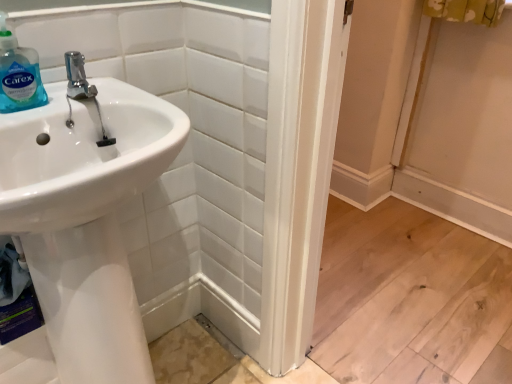
Question: In terms of width, does polished chrome faucet at upper left look wider or thinner when compared to white glossy sink at left?

Choices:
 (A) thin
 (B) wide

Answer: (B)

Question: Would you say polished chrome faucet at upper left is inside or outside white glossy sink at left?

Choices:
 (A) inside
 (B) outside

Answer: (B)

Question: Which object is the closest to the translucent plastic soap dispenser at upper left?

Choices:
 (A) polished chrome faucet at upper left
 (B) white glossy sink at left

Answer: (A)

Question: Based on their relative distances, which object is nearer to the polished chrome faucet at upper left?

Choices:
 (A) translucent plastic soap dispenser at upper left
 (B) white glossy sink at left

Answer: (A)